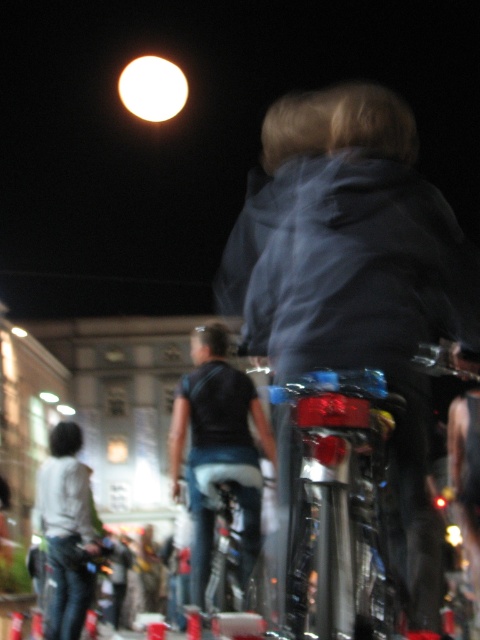
You are organizing a photo shoot and need to ensure that all participants are visible in the frame. Given the scene described, which participant wearing a black matte shirt at center or white matte shirt at lower left would require a wider angle lens to capture their full body in the photo?

The black matte shirt at center requires a wider angle lens because its width is larger than the white matte shirt at lower left, meaning it occupies more space in the frame and would need a wider angle to capture fully.

Consider the image. You are a photographer trying to capture a photo of the dark blue fabric jacket at center and the white matte shirt at lower left. Which of the two items should you focus on first if you want to ensure both are in sharp focus?

The dark blue fabric jacket at center is above the white matte shirt at lower left, so you should focus on the dark blue fabric jacket at center first to ensure both are in sharp focus.

You are standing at the point marked by the coordinates point (356, 280) in the image. What is the nearest object to you?

The nearest object to you at point (356, 280) is the dark blue fabric jacket at center.